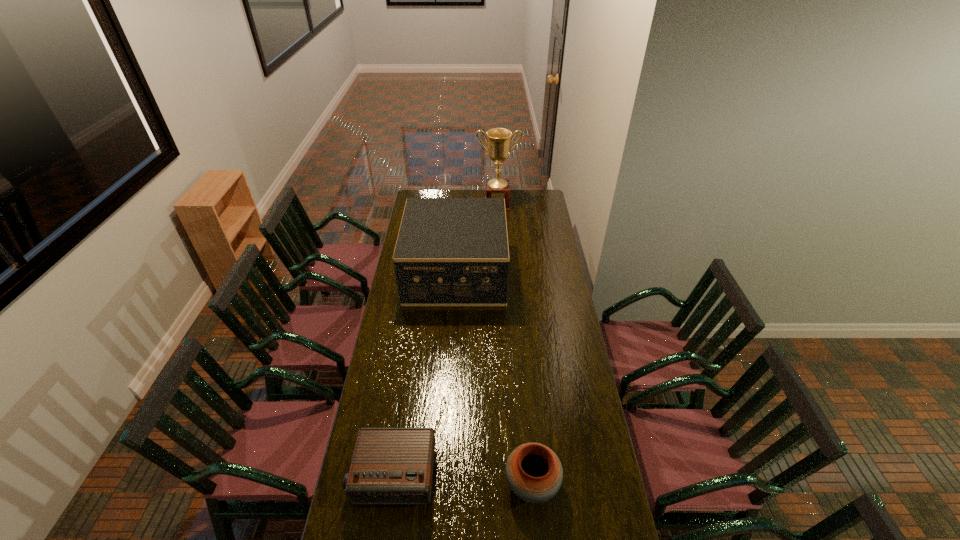
Identify the location of object located in the far edge section of the desktop. This screenshot has height=540, width=960. 499,139.

This screenshot has height=540, width=960. What are the coordinates of `box that is positioned at the left edge` in the screenshot? It's located at (450, 251).

I want to click on radio receiver situated at the left edge, so click(389, 465).

Locate an element on the screen. free location at the far edge is located at coordinates (477, 197).

Where is `vacant space at the left edge of the desktop`? Image resolution: width=960 pixels, height=540 pixels. vacant space at the left edge of the desktop is located at coordinates (394, 298).

Identify the location of vacant position at the right edge of the desktop. (540, 307).

Image resolution: width=960 pixels, height=540 pixels. In order to click on free point between the pottery and the radio receiver in this screenshot , I will do [463, 480].

The image size is (960, 540). I want to click on vacant region between the pottery and the second tallest object, so click(x=493, y=378).

Where is `free space between the farthest object and the pottery`? free space between the farthest object and the pottery is located at coordinates (515, 344).

The image size is (960, 540). Identify the location of free space between the radio receiver and the third nearest object. (424, 374).